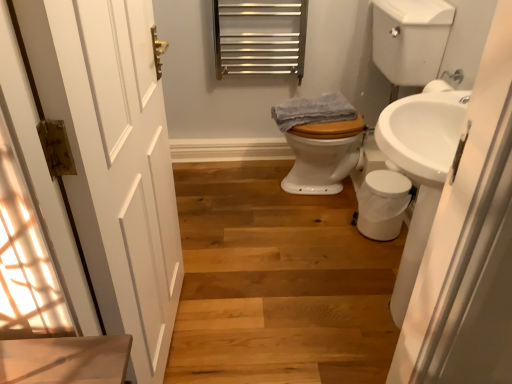
Question: Does white glossy sink at right have a lesser height compared to wooden stairs at lower left?

Choices:
 (A) yes
 (B) no

Answer: (B)

Question: Considering the relative sizes of white glossy sink at right and wooden stairs at lower left in the image provided, is white glossy sink at right thinner than wooden stairs at lower left?

Choices:
 (A) yes
 (B) no

Answer: (A)

Question: Is white glossy sink at right to the left of wooden stairs at lower left from the viewer's perspective?

Choices:
 (A) no
 (B) yes

Answer: (A)

Question: Can wooden stairs at lower left be found inside white glossy sink at right?

Choices:
 (A) yes
 (B) no

Answer: (B)

Question: From a real-world perspective, is white glossy sink at right located beneath wooden stairs at lower left?

Choices:
 (A) yes
 (B) no

Answer: (B)

Question: Can you confirm if white glossy sink at right is smaller than wooden stairs at lower left?

Choices:
 (A) yes
 (B) no

Answer: (B)

Question: Considering the relative sizes of white glossy sink at right and white wooden door at left in the image provided, is white glossy sink at right shorter than white wooden door at left?

Choices:
 (A) no
 (B) yes

Answer: (B)

Question: Could you tell me if white glossy sink at right is turned towards white wooden door at left?

Choices:
 (A) no
 (B) yes

Answer: (B)

Question: Is the depth of white glossy sink at right less than that of white wooden door at left?

Choices:
 (A) no
 (B) yes

Answer: (A)

Question: Is white glossy sink at right smaller than white wooden door at left?

Choices:
 (A) no
 (B) yes

Answer: (A)

Question: Are white glossy sink at right and white wooden door at left located far from each other?

Choices:
 (A) no
 (B) yes

Answer: (A)

Question: Does white glossy sink at right have a greater height compared to white wooden door at left?

Choices:
 (A) no
 (B) yes

Answer: (A)

Question: Can we say white wooden door at left lies outside white glossy toilet at center?

Choices:
 (A) yes
 (B) no

Answer: (A)